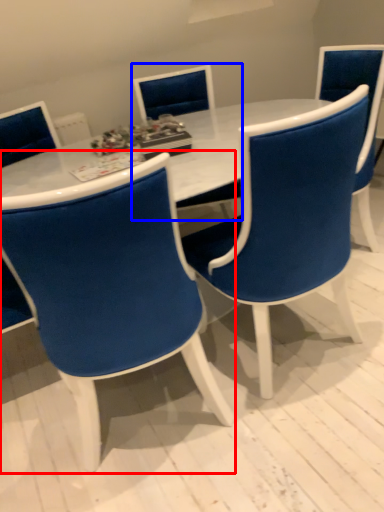
Question: Which point is further to the camera, chair (highlighted by a red box) or chair (highlighted by a blue box)?

Choices:
 (A) chair
 (B) chair

Answer: (B)